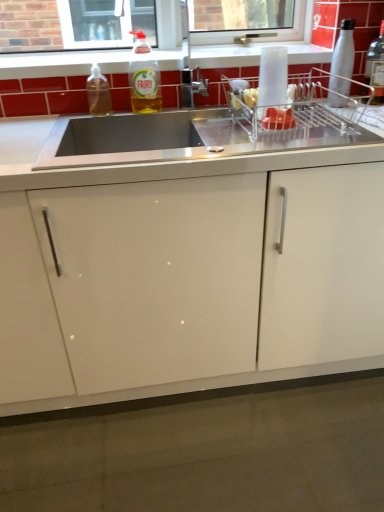
Question: From their relative heights in the image, would you say translucent plastic bottle at upper center, marked as the 2th bottle in a left-to-right arrangement, is taller or shorter than stainless steel sink at center?

Choices:
 (A) short
 (B) tall

Answer: (A)

Question: Looking at the image, does translucent plastic bottle at upper center, which is the 3th bottle from right to left, seem bigger or smaller compared to stainless steel sink at center?

Choices:
 (A) small
 (B) big

Answer: (A)

Question: Which is farther from the white glossy window sill at upper center?

Choices:
 (A) stainless steel sink at center
 (B) translucent plastic bottle at upper center, marked as the 2th bottle in a left-to-right arrangement
 (C) metallic silver dish rack at upper right
 (D) white glossy cabinet at center
 (E) stainless steel sink at center

Answer: (D)

Question: Which object is positioned farthest from the white glossy window sill at upper center?

Choices:
 (A) translucent plastic soap dispenser at upper left, arranged as the 1th bottle when viewed from the left
 (B) silver metallic bottle at upper right, the second bottle from the right
 (C) translucent plastic bottle at upper center, which is the 3th bottle from right to left
 (D) white glossy cabinet at center
 (E) clear glass bottle at upper right, which appears as the 1th bottle when viewed from the right

Answer: (D)